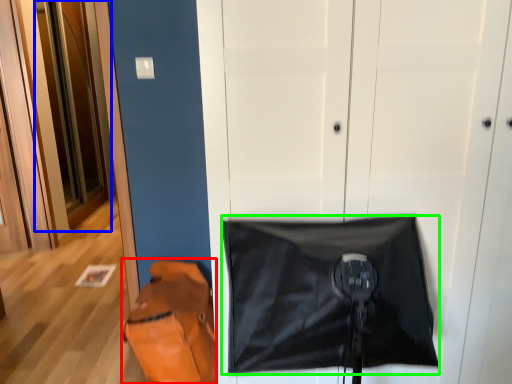
Question: Which object is the farthest from messenger bag (highlighted by a red box)? Choose among these: door (highlighted by a blue box) or blanket (highlighted by a green box).

Choices:
 (A) door
 (B) blanket

Answer: (A)